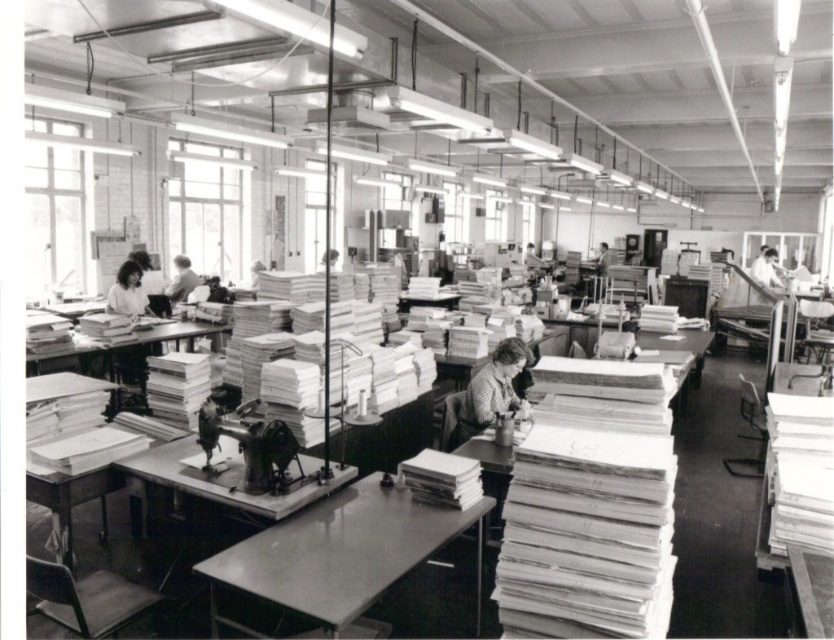
You are a worker in the sewing room and need to place a new fabric roll on the table closest to the smooth white blouse at left. Which table should you use, the metallic gray table at center or the one further to the right?

The metallic gray table at center is positioned on the right side of the smooth white blouse at left, so it is the closest table to the blouse. You should use the metallic gray table at center.

You are a maintenance worker in the sewing room and need to move a 2.5 meter long ladder from the entrance to the metallic gray table at center. The entrance is located at the far end of the room. Is there enough space to maneuver the ladder horizontally through the narrowest part of the room?

The tables are 2.38 meters apart, which is slightly less than the ladder length of 2.5 meters. Therefore, the ladder cannot be maneuvered horizontally through the narrowest part of the room.